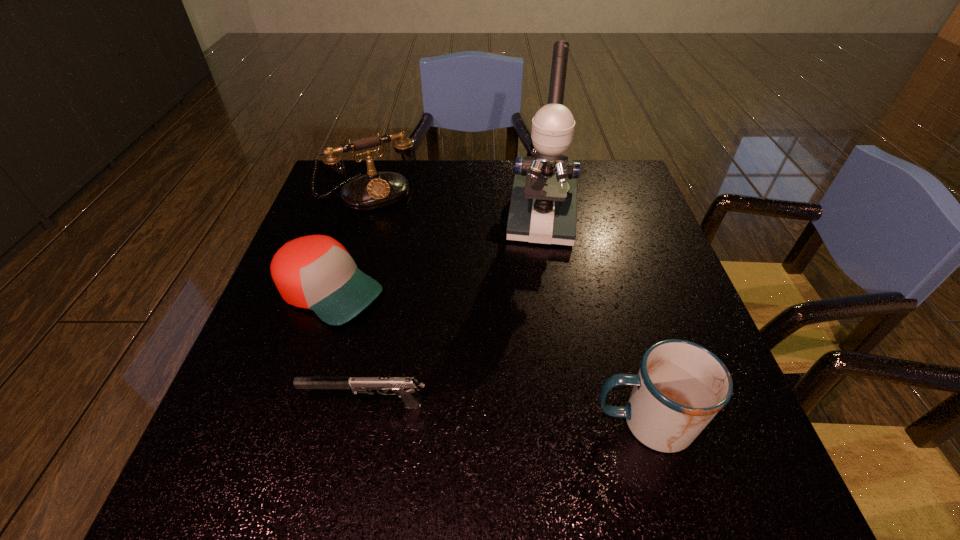
This screenshot has width=960, height=540. In order to click on free space located 0.280m at the eyepiece of the tallest object in this screenshot , I will do `click(534, 337)`.

Where is `telephone located at the far edge`? The image size is (960, 540). telephone located at the far edge is located at coordinates (375, 190).

Identify the location of microscope that is at the far edge. Image resolution: width=960 pixels, height=540 pixels. (543, 208).

Where is `gun that is at the near edge`? gun that is at the near edge is located at coordinates (405, 387).

Identify the location of mug present at the near edge. (680, 387).

You are a GUI agent. You are given a task and a screenshot of the screen. Output one action in this format:
    pyautogui.click(x=<x>, y=<y>)
    Task: Click on the gun present at the left edge
    
    Given the screenshot: What is the action you would take?
    pyautogui.click(x=405, y=387)

Where is `baseball cap that is at the left edge`? The height and width of the screenshot is (540, 960). baseball cap that is at the left edge is located at coordinates (316, 272).

Where is `telephone at the left edge`? telephone at the left edge is located at coordinates click(x=375, y=190).

Where is `object at the right edge`? object at the right edge is located at coordinates (680, 387).

In order to click on object located at the far left corner in this screenshot , I will do `click(375, 190)`.